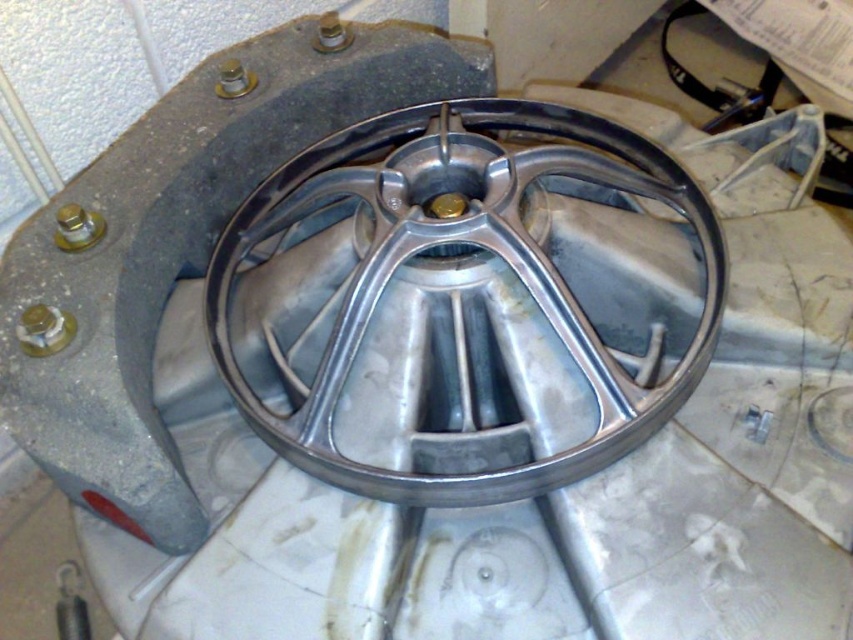
You are an engineer inspecting the industrial equipment. You notice two bolts securing the base of the circular component. Which bolt is taller, the matte silver bolt at upper left or the gold metallic bolt at center?

The matte silver bolt at upper left is taller than the gold metallic bolt at center.

You are an engineer inspecting a machine part. You need to locate the polished silver rim at center. Where is it positioned in terms of coordinates?

The polished silver rim at center is positioned at coordinates point (486, 248).

You are an engineer inspecting the metallic object. You notice the polished silver rim at center and the matte gold bolt at upper left. From your viewpoint, which object is closer to you?

The polished silver rim at center is closer to you because it is in front of the matte gold bolt at upper left.